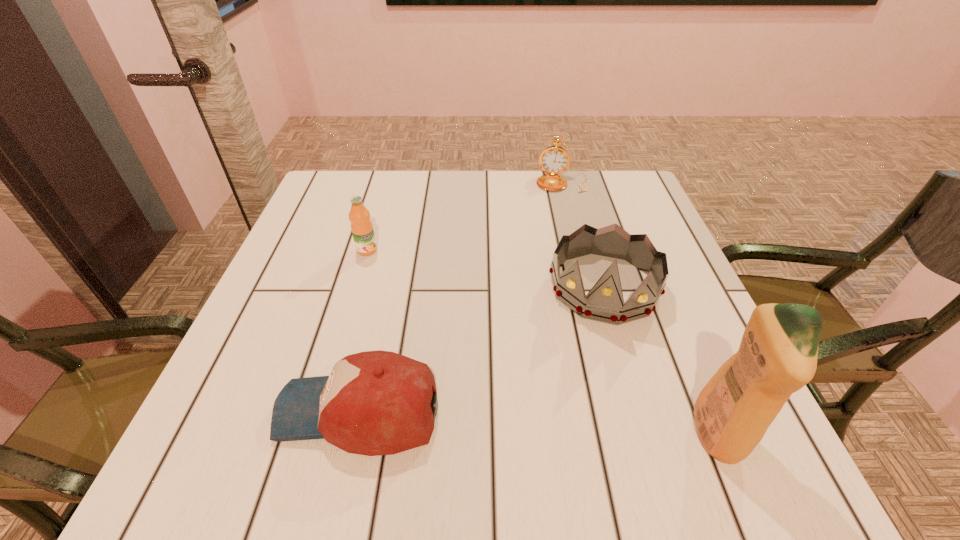
You are a GUI agent. You are given a task and a screenshot of the screen. Output one action in this format:
    pyautogui.click(x=<x>, y=<y>)
    Task: Click on the baseball cap
    The height and width of the screenshot is (540, 960).
    Given the screenshot: What is the action you would take?
    pyautogui.click(x=374, y=403)

Find the location of a particular element. Image resolution: width=960 pixels, height=540 pixels. the tallest object is located at coordinates (777, 356).

This screenshot has width=960, height=540. I want to click on orange juice, so click(x=362, y=230).

I want to click on the second tallest object, so click(604, 302).

Identify the location of pocket watch. (554, 160).

The height and width of the screenshot is (540, 960). What are the coordinates of `vacant area located 0.070m on the front-facing side of the baseball cap` in the screenshot? It's located at (237, 411).

Identify the location of free point located on the label of the orange juice. The height and width of the screenshot is (540, 960). (396, 281).

This screenshot has width=960, height=540. I want to click on vacant area situated 0.160m on the label of the orange juice, so click(x=407, y=295).

Locate an element on the screen. This screenshot has width=960, height=540. free space located on the label of the orange juice is located at coordinates (389, 274).

Find the location of a particular element. The height and width of the screenshot is (540, 960). free space located 0.140m at the front of the tiara with jewels is located at coordinates tap(590, 387).